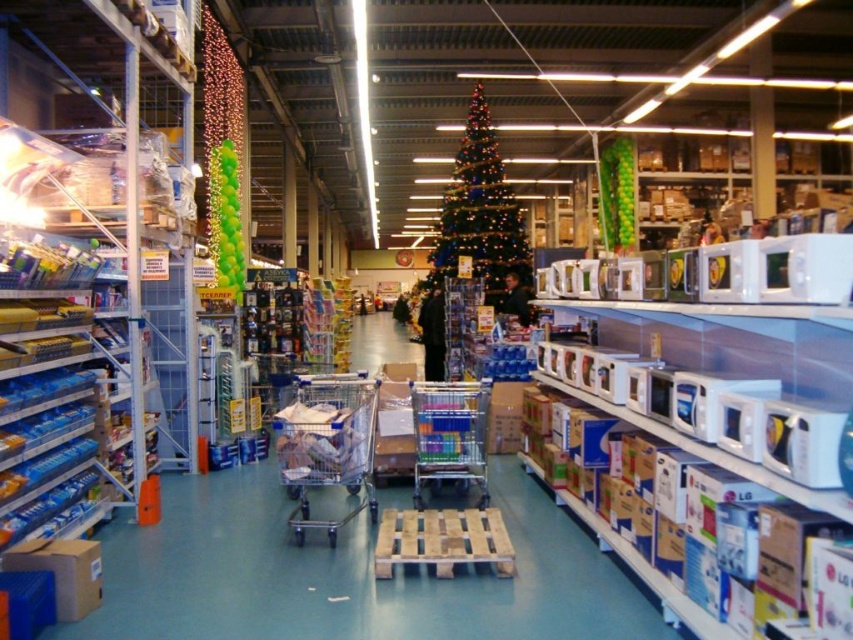
Question: Which point appears farthest from the camera in this image?

Choices:
 (A) (323, 380)
 (B) (465, 420)

Answer: (A)

Question: Which is nearer to the green glittering christmas tree at center?

Choices:
 (A) metallic silver shopping cart at center
 (B) chrome metallic shopping cart at center

Answer: (B)

Question: Can you confirm if green glittering christmas tree at center is wider than chrome metallic shopping cart at center?

Choices:
 (A) yes
 (B) no

Answer: (A)

Question: Does green glittering christmas tree at center appear under metallic silver shopping cart at center?

Choices:
 (A) yes
 (B) no

Answer: (B)

Question: Which point is closer to the camera?

Choices:
 (A) (308, 458)
 (B) (480, 225)

Answer: (A)

Question: Observing the image, what is the correct spatial positioning of metallic silver shopping cart at center in reference to chrome metallic shopping cart at center?

Choices:
 (A) right
 (B) left

Answer: (B)